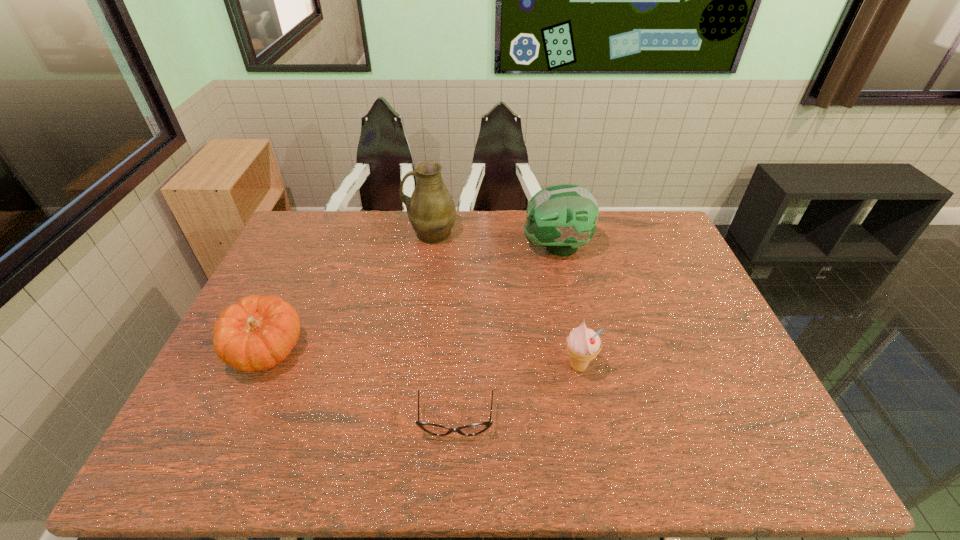
This screenshot has height=540, width=960. I want to click on pitcher, so 431,210.

This screenshot has width=960, height=540. Identify the location of football helmet. (563, 217).

At what (x,y) coordinates should I click in order to perform the action: click on icecream. Please return your answer as a coordinate pair (x, y). The image size is (960, 540). Looking at the image, I should click on (583, 344).

The image size is (960, 540). Find the location of `the leftmost object`. the leftmost object is located at coordinates pyautogui.click(x=258, y=332).

The image size is (960, 540). I want to click on spectacles, so click(x=473, y=429).

In order to click on the shortest object in this screenshot , I will do `click(473, 429)`.

You are a GUI agent. You are given a task and a screenshot of the screen. Output one action in this format:
    pyautogui.click(x=<x>, y=<y>)
    Task: Click on the free location located on the handle side of the pitcher
    
    Given the screenshot: What is the action you would take?
    pyautogui.click(x=374, y=234)

Identify the location of vacant space located 0.290m on the handle side of the pitcher. The width and height of the screenshot is (960, 540). (324, 234).

You are a GUI agent. You are given a task and a screenshot of the screen. Output one action in this format:
    pyautogui.click(x=<x>, y=<y>)
    Task: Click on the vacant space located 0.390m on the handle side of the pitcher
    
    Given the screenshot: What is the action you would take?
    pyautogui.click(x=296, y=234)

The height and width of the screenshot is (540, 960). Find the location of `free space located on the visor of the football helmet`. free space located on the visor of the football helmet is located at coordinates (452, 247).